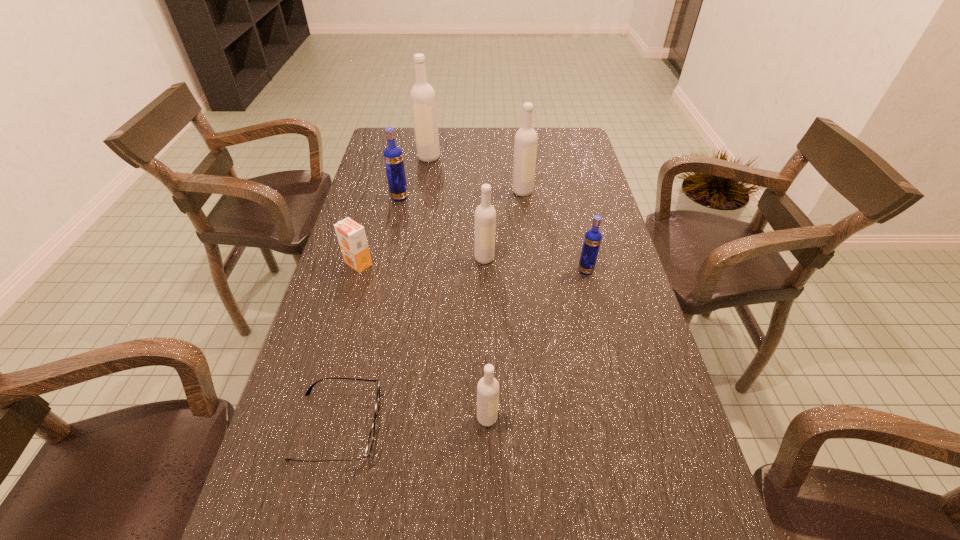
At what (x,y) coordinates should I click in order to perform the action: click on the nearest vodka. Please return your answer as a coordinate pair (x, y). Looking at the image, I should click on (488, 387).

What are the coordinates of `orange orange juice` in the screenshot? It's located at (351, 236).

This screenshot has height=540, width=960. I want to click on the seventh tallest object, so click(351, 236).

Image resolution: width=960 pixels, height=540 pixels. Identify the location of spectacles. (372, 433).

At what (x,y) coordinates should I click in order to perform the action: click on vacant region located on the right of the leftmost white vodka. Please return your answer as a coordinate pair (x, y). Looking at the image, I should click on (486, 157).

Image resolution: width=960 pixels, height=540 pixels. Identify the location of vacant space located on the left of the third smallest white vodka. (401, 191).

At what (x,y) coordinates should I click in order to perform the action: click on blank area located 0.200m on the front of the bigger blue vodka. Please return your answer as a coordinate pair (x, y). Looking at the image, I should click on (390, 242).

Find the location of `free region located 0.130m on the back of the second smallest white vodka`. free region located 0.130m on the back of the second smallest white vodka is located at coordinates (484, 224).

Identify the location of vacant space located 0.090m on the left of the nearer blue vodka. Image resolution: width=960 pixels, height=540 pixels. (545, 270).

This screenshot has width=960, height=540. Find the location of `free spot located on the back of the nearest white vodka`. free spot located on the back of the nearest white vodka is located at coordinates (487, 367).